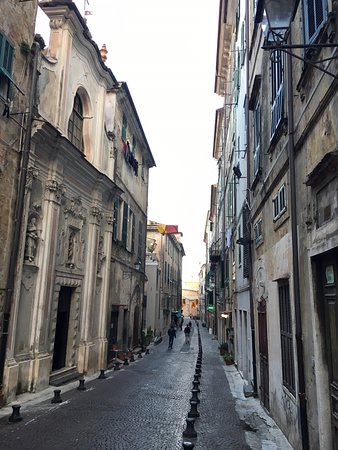
Locate an element on the screen. Image resolution: width=338 pixels, height=450 pixels. window is located at coordinates (79, 129), (125, 234), (163, 278), (168, 275), (279, 81), (308, 25).